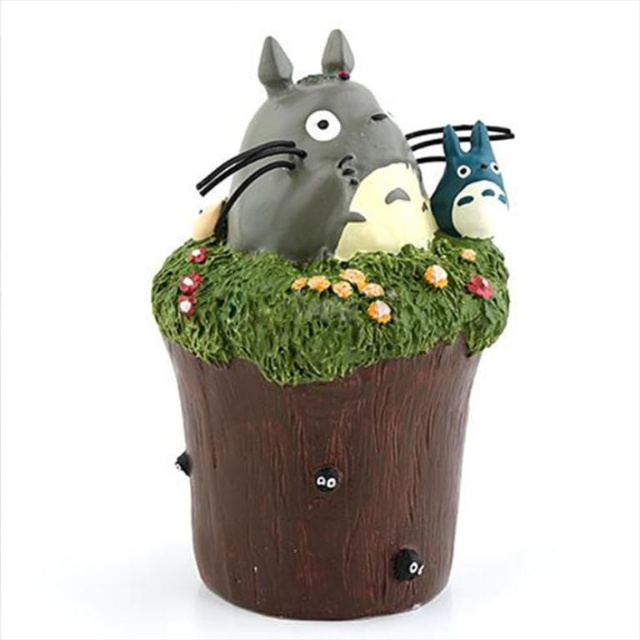
Is point (502, 304) in front of point (497, 308)?

No.

Between matte brown tree stump at center and green grass at center, which one appears on the left side from the viewer's perspective?

From the viewer's perspective, matte brown tree stump at center appears more on the left side.

Is point (362, 497) more distant than point (467, 250)?

That is False.

Where is `matte brown tree stump at center`? matte brown tree stump at center is located at coordinates (324, 355).

Can you confirm if green grass at center is thinner than blue matte totoro at center?

No, green grass at center is not thinner than blue matte totoro at center.

Can you confirm if green grass at center is positioned above blue matte totoro at center?

Actually, green grass at center is below blue matte totoro at center.

Identify the location of green grass at center. This screenshot has height=640, width=640. (330, 305).

Does green grass at center appear under matte gray cat at upper center?

Correct, green grass at center is located below matte gray cat at upper center.

Can you confirm if green grass at center is wider than matte gray cat at upper center?

Indeed, green grass at center has a greater width compared to matte gray cat at upper center.

Does point (170, 276) lie in front of point (317, 138)?

No, (170, 276) is further to viewer.

At what (x,y) coordinates should I click in order to perform the action: click on green grass at center. Please return your answer as a coordinate pair (x, y). Looking at the image, I should click on (330, 305).